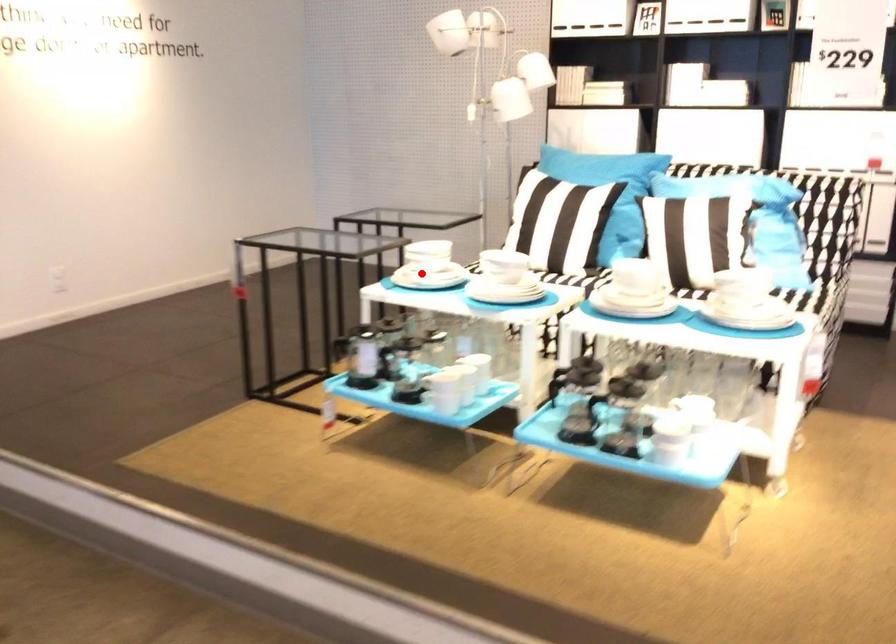
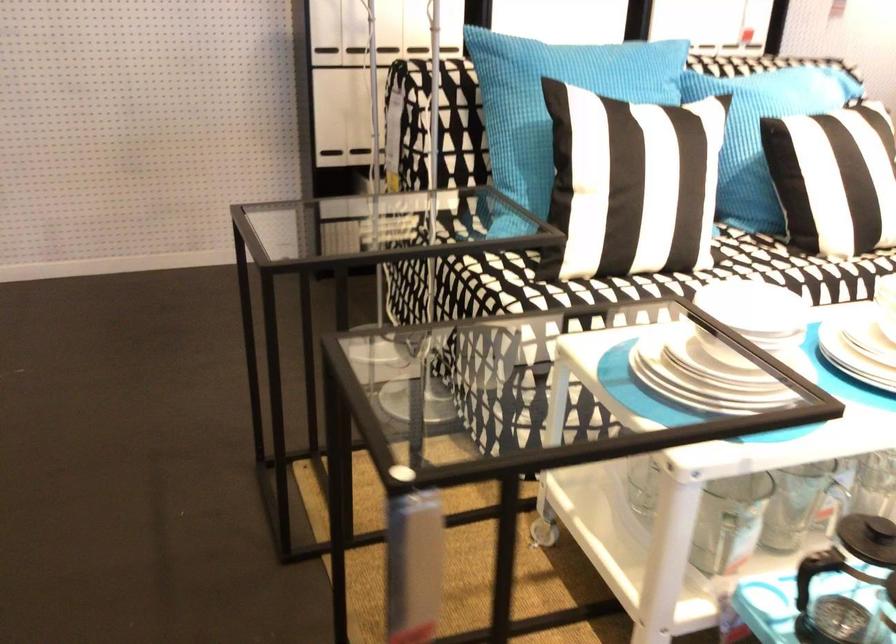
Locate, in the second image, the point that corresponds to the highlighted location in the first image.

(709, 373)